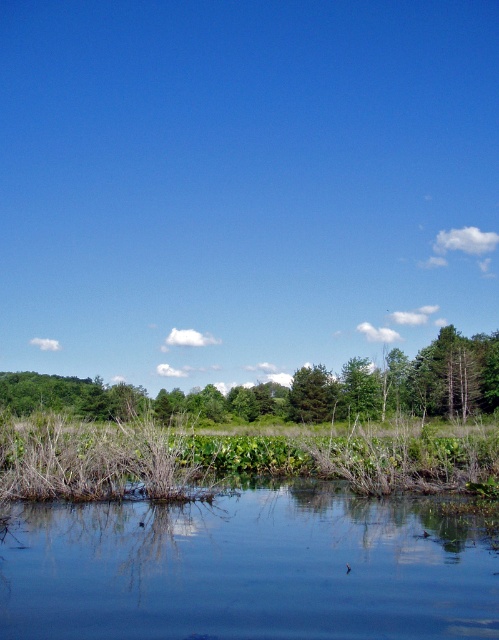
Question: Which object is closer to the camera taking this photo?

Choices:
 (A) green leafy tree at center
 (B) green matte tree at center

Answer: (A)

Question: Which object is farther from the camera taking this photo?

Choices:
 (A) green matte tree at center
 (B) green leafy tree at center

Answer: (A)

Question: Does green leafy tree at center have a larger size compared to green matte tree at center?

Choices:
 (A) no
 (B) yes

Answer: (B)

Question: Which point is closer to the camera taking this photo?

Choices:
 (A) (416, 368)
 (B) (287, 403)
 (C) (70, 490)
 (D) (207, 532)

Answer: (D)

Question: Can you confirm if clear water at lower center is smaller than green leafy tree at center?

Choices:
 (A) yes
 (B) no

Answer: (A)

Question: Can you confirm if green grassy reed at lower center is bigger than green matte tree at center?

Choices:
 (A) yes
 (B) no

Answer: (B)